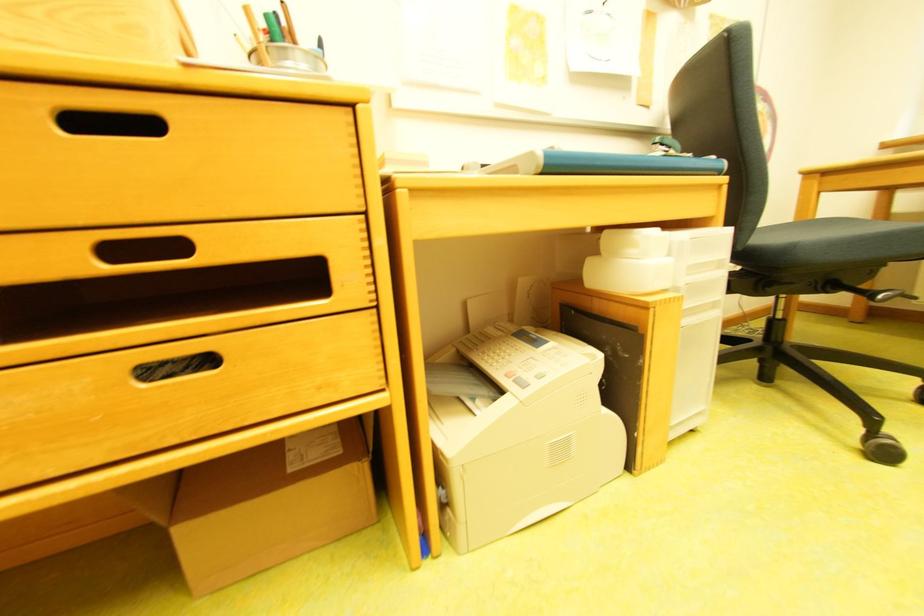
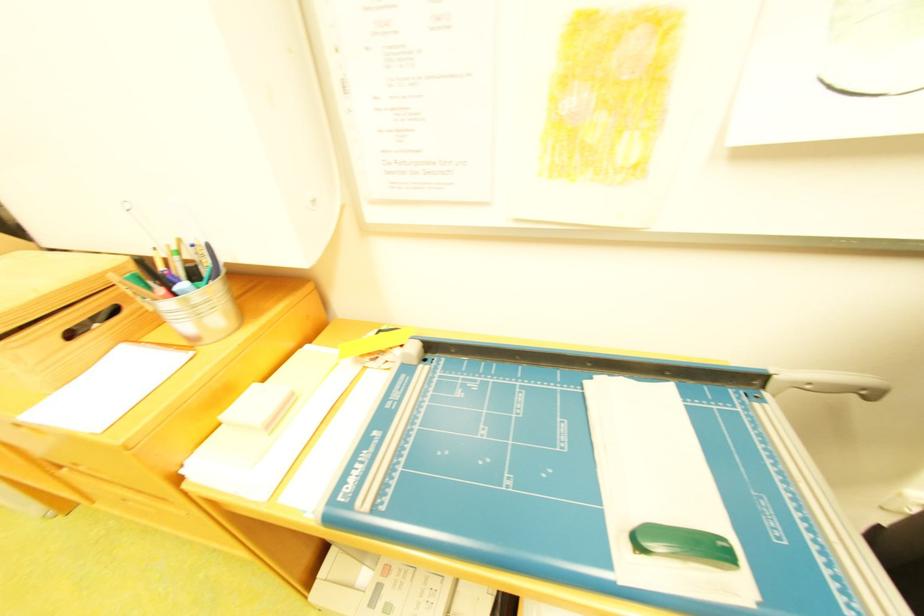
The first image is from the beginning of the video and the second image is from the end. How did the camera likely rotate when shooting the video?

The rotation direction of the camera is left-down.